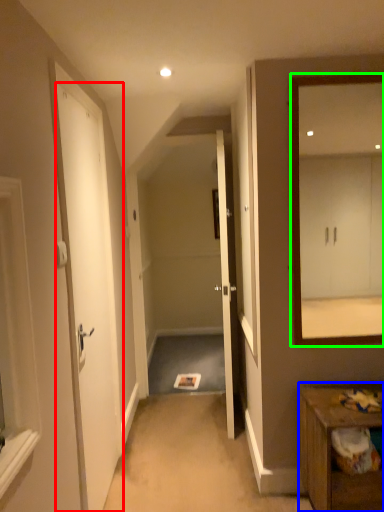
Question: Which object is the farthest from door (highlighted by a red box)? Choose among these: table (highlighted by a blue box) or mirror (highlighted by a green box).

Choices:
 (A) table
 (B) mirror

Answer: (B)